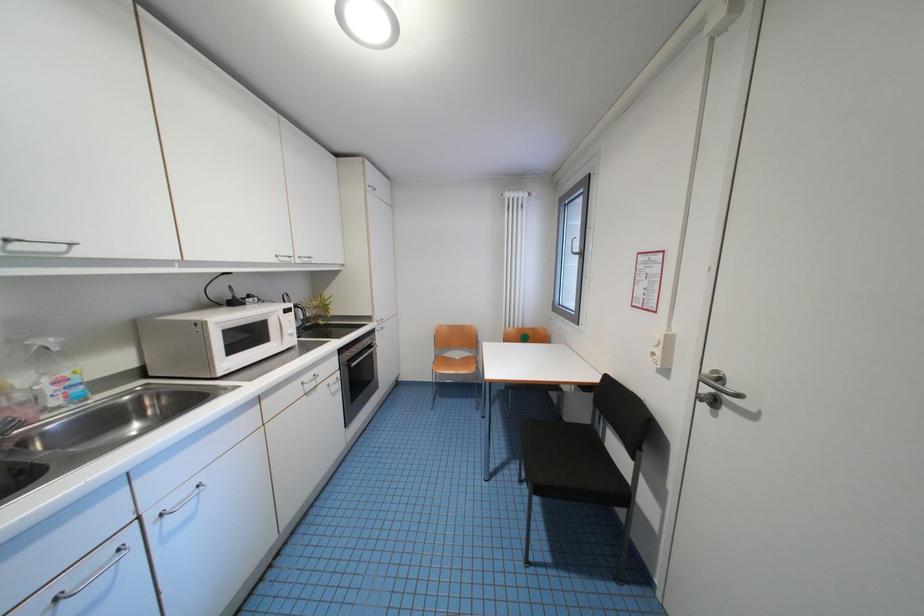
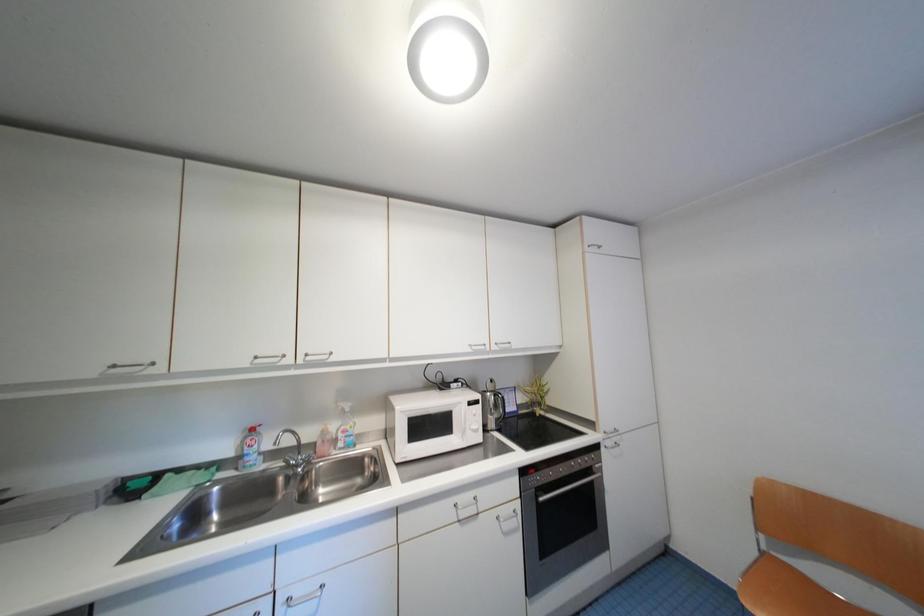
Question: The camera is either moving clockwise (left) or counter-clockwise (right) around the object. The first image is from the beginning of the video and the second image is from the end. Is the camera moving left or right when shooting the video?

Choices:
 (A) Left
 (B) Right

Answer: (B)